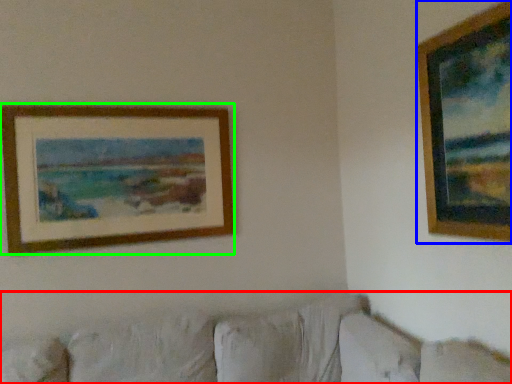
Question: Considering the real-world distances, which object is farthest from couch (highlighted by a red box)? picture frame (highlighted by a blue box) or picture frame (highlighted by a green box)?

Choices:
 (A) picture frame
 (B) picture frame

Answer: (A)